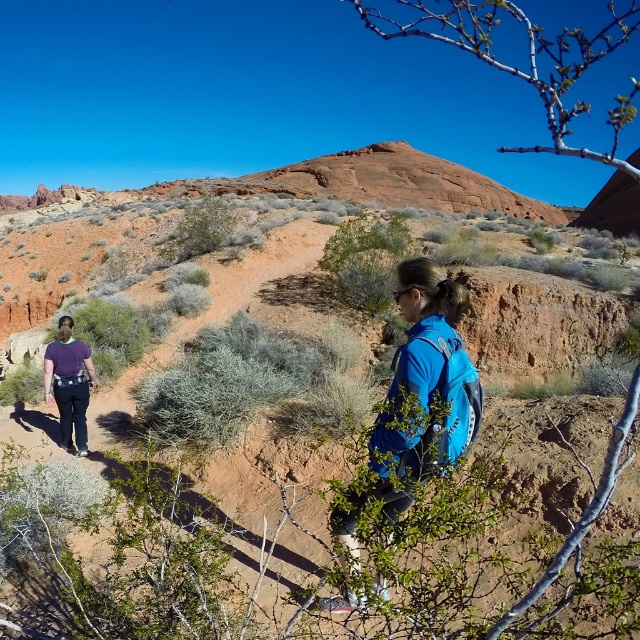
Can you confirm if blue fabric backpack at center is wider than purple fabric backpack at lower left?

Yes.

Is point (401, 444) positioned after point (61, 388)?

No, (401, 444) is in front of (61, 388).

The height and width of the screenshot is (640, 640). What do you see at coordinates (429, 371) in the screenshot? I see `blue fabric backpack at center` at bounding box center [429, 371].

Identify the location of blue fabric backpack at center. The width and height of the screenshot is (640, 640). (429, 371).